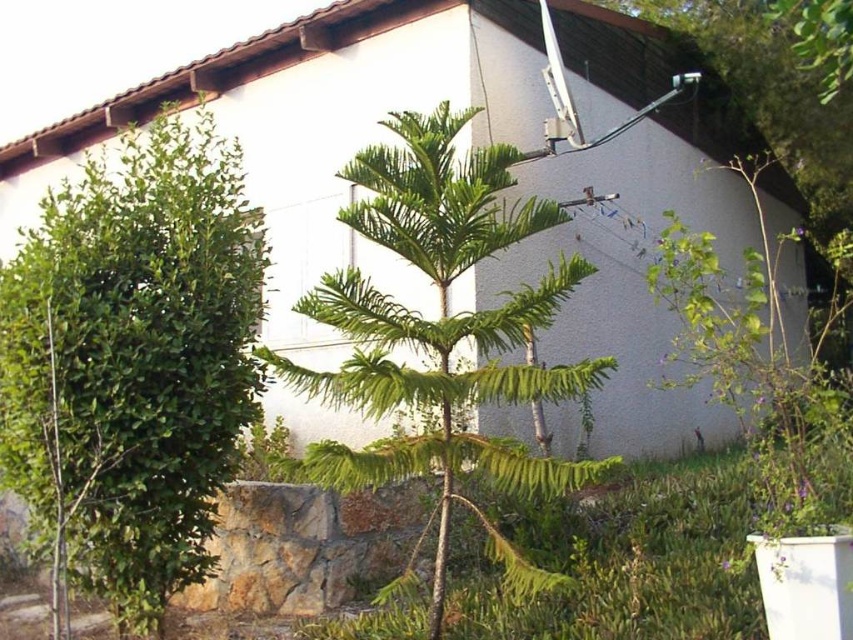
Question: Which point is closer to the camera?

Choices:
 (A) green leafy palm tree at center
 (B) green leafy shrub at left

Answer: (A)

Question: Is green leafy shrub at left in front of green leafy palm tree at center?

Choices:
 (A) yes
 (B) no

Answer: (B)

Question: Is green leafy shrub at left above green leafy palm tree at center?

Choices:
 (A) no
 (B) yes

Answer: (A)

Question: Observing the image, what is the correct spatial positioning of green leafy shrub at left in reference to green leafy palm tree at center?

Choices:
 (A) above
 (B) below

Answer: (B)

Question: Which point is farther from the camera taking this photo?

Choices:
 (A) (598, 384)
 (B) (165, 435)

Answer: (A)